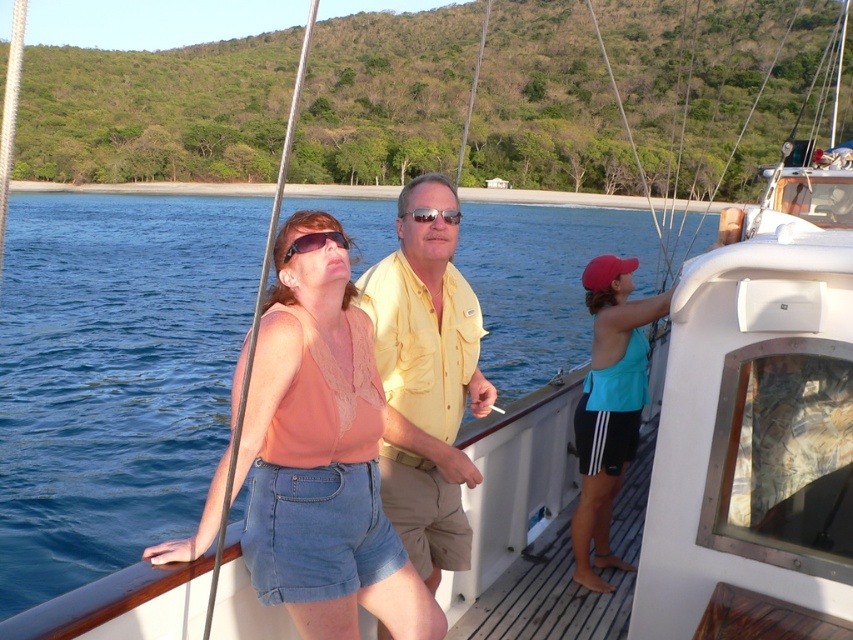
Which is more to the right, matte peach tank top at center or yellow cotton shirt at center?

yellow cotton shirt at center is more to the right.

Image resolution: width=853 pixels, height=640 pixels. I want to click on matte peach tank top at center, so click(x=321, y=456).

Identify the location of matte peach tank top at center. (321, 456).

Is matte peach tank top at center bigger than shiny gold sunglasses at center?

Yes, matte peach tank top at center is bigger than shiny gold sunglasses at center.

Between point (296, 595) and point (422, 209), which one is positioned behind?

Point (422, 209)

Identify the location of matte peach tank top at center. This screenshot has width=853, height=640. (321, 456).

Between yellow cotton shirt at center and matte black sunglasses at center, which one has less height?

matte black sunglasses at center

Does yellow cotton shirt at center have a greater height compared to matte black sunglasses at center?

Correct, yellow cotton shirt at center is much taller as matte black sunglasses at center.

Is point (415, 259) farther from viewer compared to point (308, 248)?

Yes, it is.

Locate an element on the screen. The image size is (853, 640). yellow cotton shirt at center is located at coordinates (426, 390).